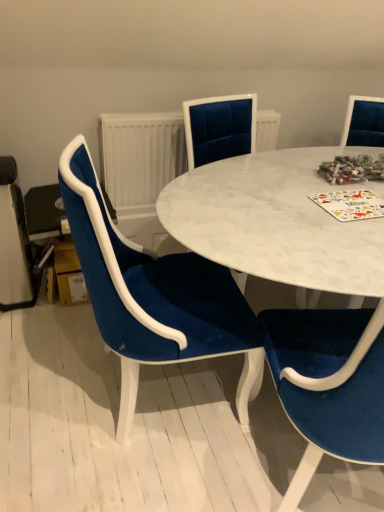
At what (x,y) coordinates should I click in order to perform the action: click on free space above multicolored paper at center (from a real-world perspective). Please return your answer as a coordinate pair (x, y). Looking at the image, I should click on (346, 197).